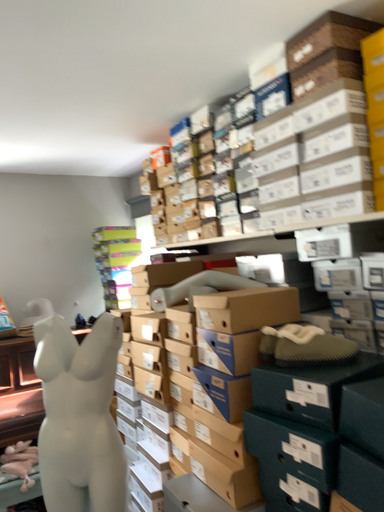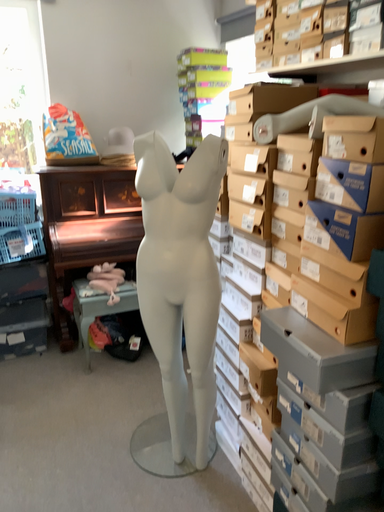
Question: How did the camera likely rotate when shooting the video?

Choices:
 (A) rotated right
 (B) rotated left

Answer: (B)